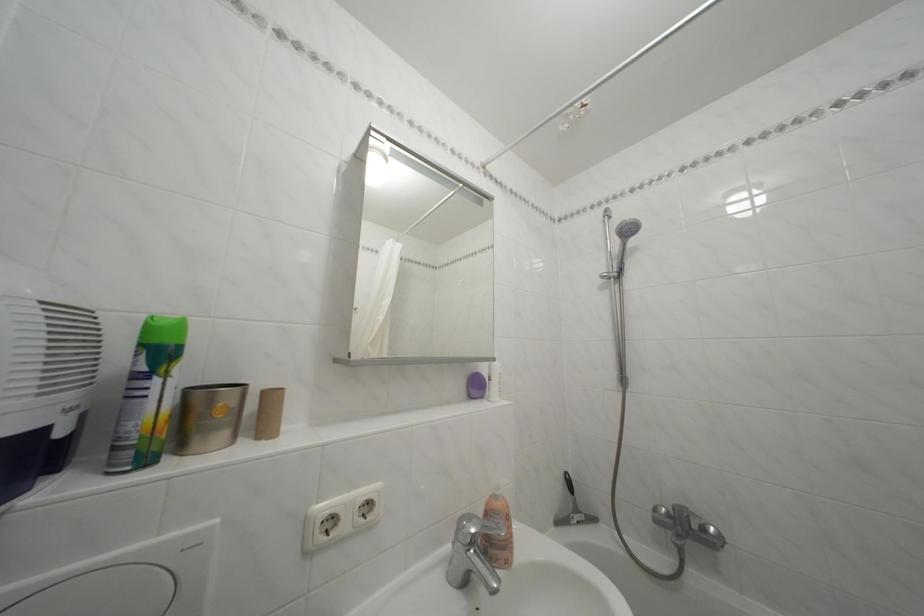
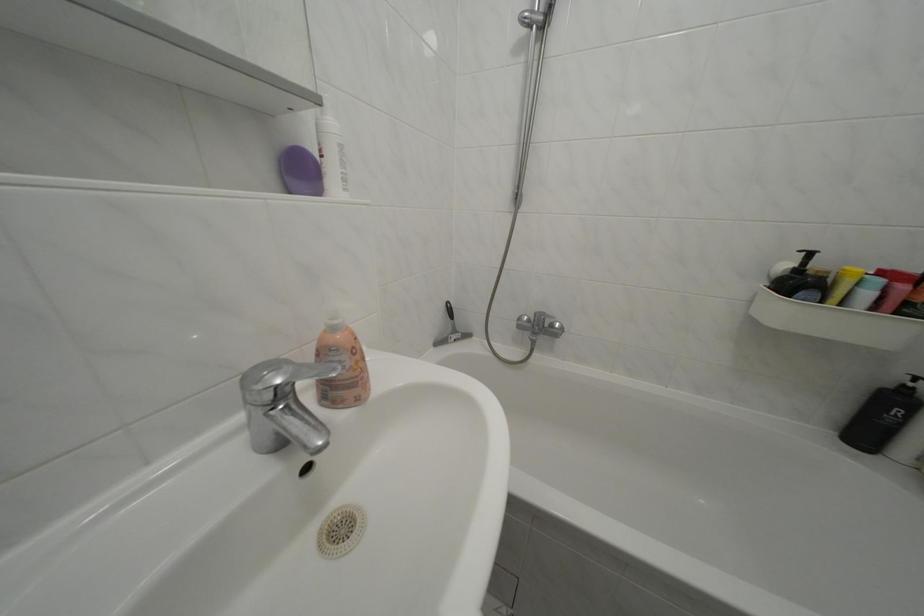
In the second image, find the point that corresponds to point (483, 378) in the first image.

(301, 150)